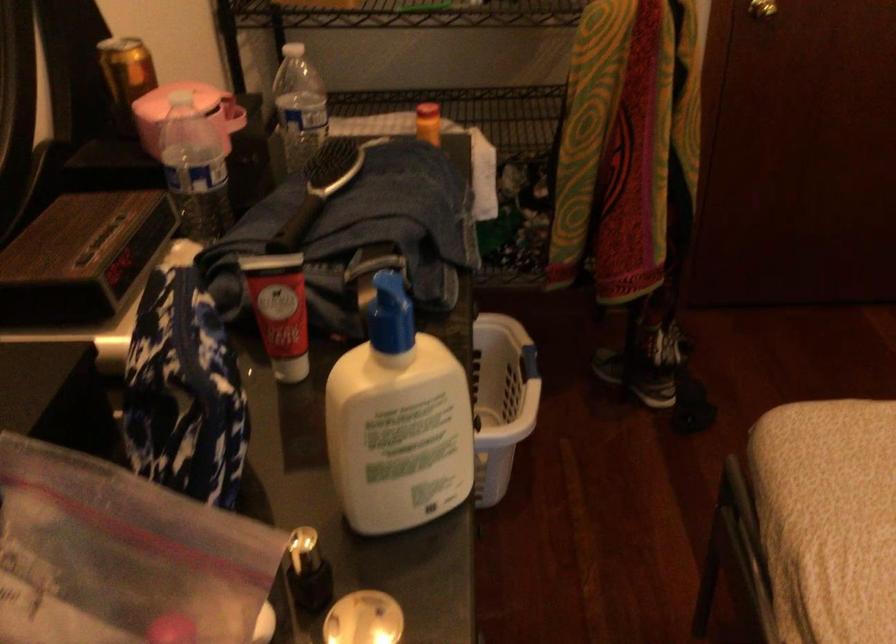
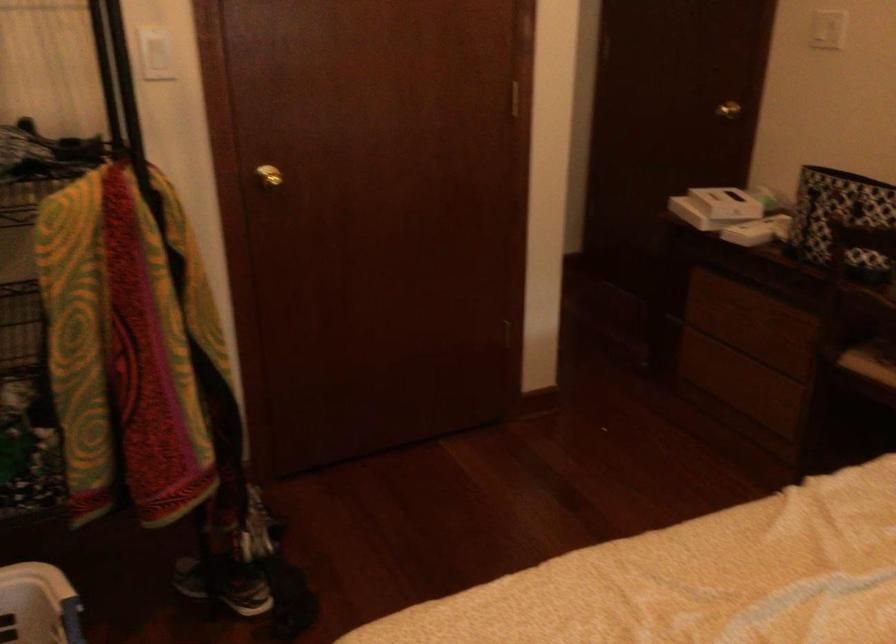
Locate, in the second image, the point that corresponds to (x=505, y=346) in the first image.

(38, 605)